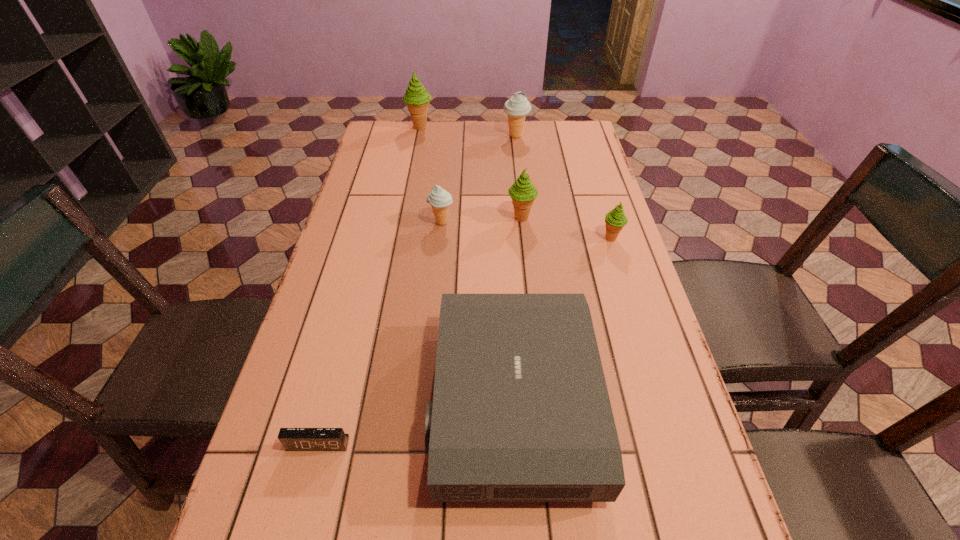
Identify the location of the biggest green icecream. (416, 97).

Where is `the tallest icecream`? The width and height of the screenshot is (960, 540). the tallest icecream is located at coordinates (416, 97).

You are a GUI agent. You are given a task and a screenshot of the screen. Output one action in this format:
    pyautogui.click(x=<x>, y=<y>)
    Task: Click on the bigger beige icecream
    
    Given the screenshot: What is the action you would take?
    pyautogui.click(x=517, y=107)

You are a GUI agent. You are given a task and a screenshot of the screen. Output one action in this format:
    pyautogui.click(x=<x>, y=<y>)
    Task: Click on the farther beige icecream
    
    Given the screenshot: What is the action you would take?
    pyautogui.click(x=517, y=107)

Where is `the second farthest green icecream`? the second farthest green icecream is located at coordinates (523, 192).

The image size is (960, 540). What are the coordinates of `the second green icecream from left to right` in the screenshot? It's located at [523, 192].

I want to click on the nearer beige icecream, so click(440, 199).

The image size is (960, 540). In order to click on the fourth icecream from right to left in this screenshot , I will do `click(440, 199)`.

Find the location of a particular element. This screenshot has width=960, height=540. the rightmost object is located at coordinates (615, 220).

Locate an element on the screen. Image resolution: width=960 pixels, height=540 pixels. the nearest icecream is located at coordinates (615, 220).